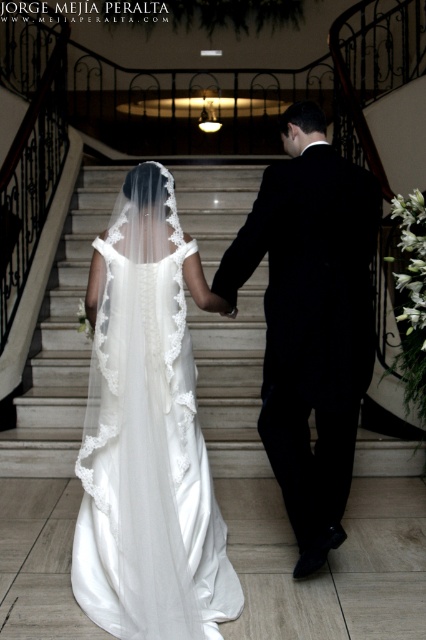
Question: Which object is farther from the camera taking this photo?

Choices:
 (A) black satin suit at center
 (B) white marble stairs at center

Answer: (B)

Question: Which of these objects is positioned farthest from the black satin suit at center?

Choices:
 (A) white marble stairs at center
 (B) white satin dress at center

Answer: (A)

Question: Can you confirm if black satin suit at center is positioned below white marble stairs at center?

Choices:
 (A) no
 (B) yes

Answer: (B)

Question: Is black satin suit at center further to the viewer compared to white marble stairs at center?

Choices:
 (A) yes
 (B) no

Answer: (B)

Question: Is the position of black satin suit at center more distant than that of white marble stairs at center?

Choices:
 (A) yes
 (B) no

Answer: (B)

Question: Which point is closer to the camera taking this photo?

Choices:
 (A) (264, 200)
 (B) (127, 193)

Answer: (A)